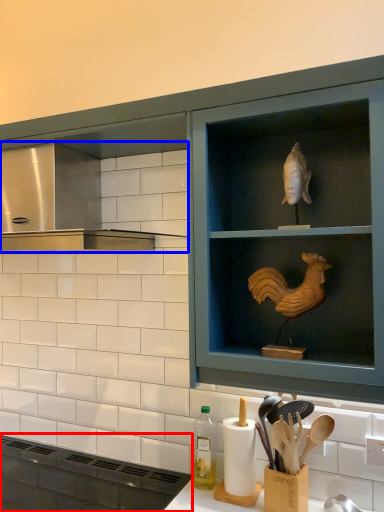
Question: Which object is closer to the camera taking this photo, appliance (highlighted by a red box) or vent (highlighted by a blue box)?

Choices:
 (A) appliance
 (B) vent

Answer: (A)